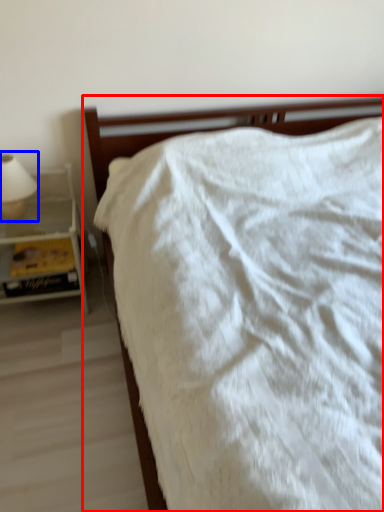
Question: Which object appears closest to the camera in this image, bed (highlighted by a red box) or bedside lamp (highlighted by a blue box)?

Choices:
 (A) bed
 (B) bedside lamp

Answer: (A)